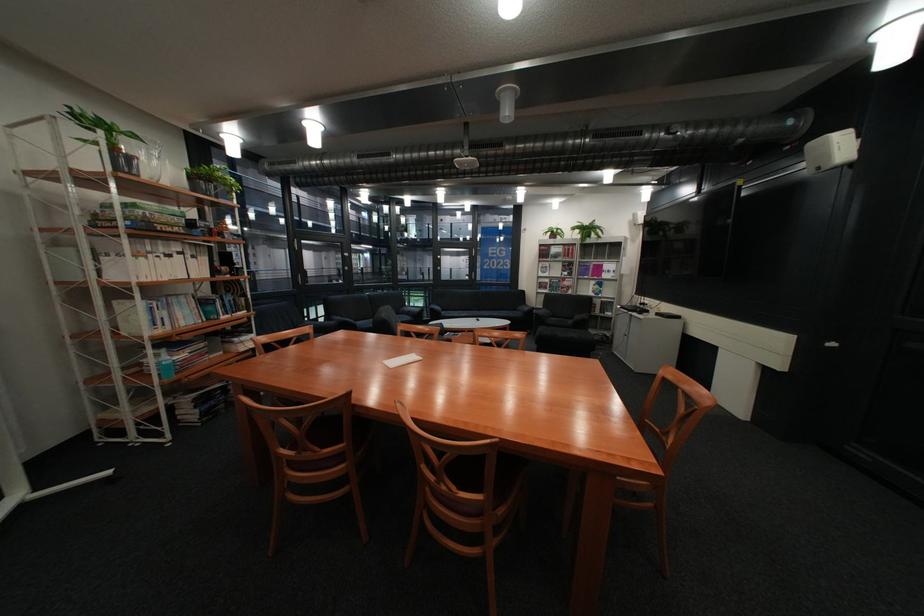
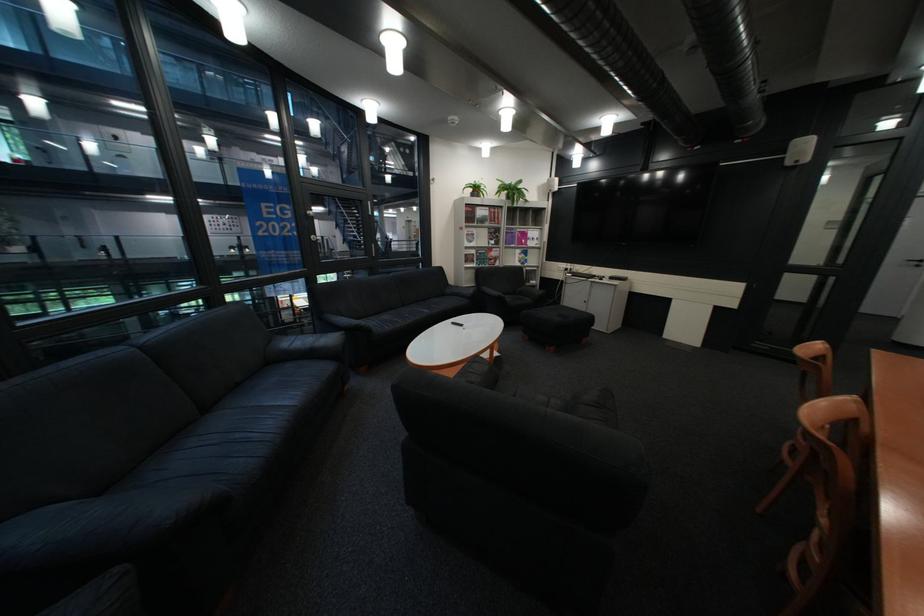
Locate, in the second image, the point that corresponds to (x=566, y=262) in the first image.

(492, 229)